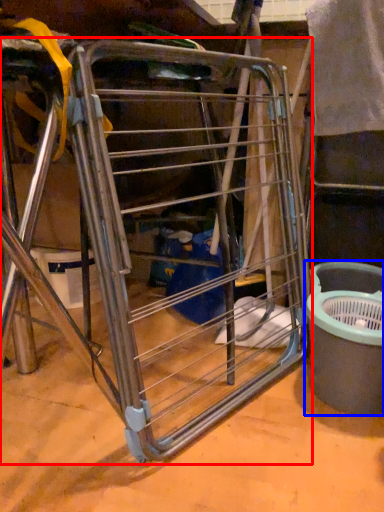
Question: Which object appears farthest to the camera in this image, furniture (highlighted by a red box) or recycling bin (highlighted by a blue box)?

Choices:
 (A) furniture
 (B) recycling bin

Answer: (B)